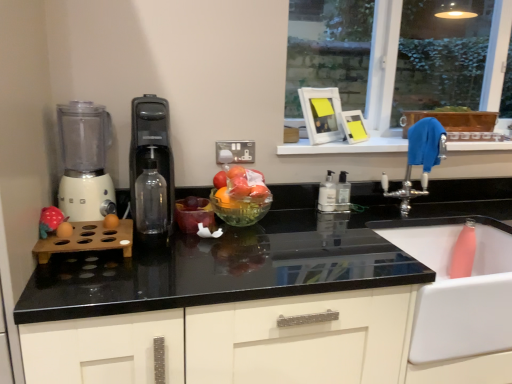
Describe the element at coordinates (345, 146) in the screenshot. I see `blue fabric at upper right` at that location.

Locate an element on the screen. Image resolution: width=512 pixels, height=384 pixels. clear plastic soap dispenser at center, the first bottle positioned from the right is located at coordinates (343, 193).

In order to face silver metallic faucet at upper right, should I rotate leftwards or rightwards?

To face it directly, rotate right by 20.633 degrees.

Find the location of `black plastic water dispenser at center`. black plastic water dispenser at center is located at coordinates 151,167.

Measure the distance between black plastic water dispenser at center and camera.

black plastic water dispenser at center and camera are 1.20 meters apart from each other.

Image resolution: width=512 pixels, height=384 pixels. Find the location of `blue fabric at upper right`. blue fabric at upper right is located at coordinates (345, 146).

Does point (42, 228) come farther from viewer compared to point (214, 189)?

No, it is in front of (214, 189).

Is matte pink plush toy at left oriented away from transparent glass bowl at center?

matte pink plush toy at left is not turned away from transparent glass bowl at center.

Which of these two, matte pink plush toy at left or transparent glass bowl at center, is smaller?

Smaller between the two is matte pink plush toy at left.

You are a GUI agent. You are given a task and a screenshot of the screen. Output one action in this format:
    pyautogui.click(x=<x>, y=<y>)
    Task: Click on the toy in front of the transparent glass bowl at center
    
    Given the screenshot: What is the action you would take?
    pyautogui.click(x=50, y=220)

Can you confirm if silver metallic faucet at upper right is positioned to the right of pink matte bottle at lower right?

No.

Where is `sink below the silver metallic faucet at upper right (from a real-world perspective)`? sink below the silver metallic faucet at upper right (from a real-world perspective) is located at coordinates (457, 287).

From the image's perspective, between silver metallic faucet at upper right and pink matte bottle at lower right, which one is located above?

silver metallic faucet at upper right is shown above in the image.

Is silver metallic faucet at upper right touching pink matte bottle at lower right?

No, silver metallic faucet at upper right is not touching pink matte bottle at lower right.

Between translucent plastic bowl at center and black glossy countertop at center, which one appears on the left side from the viewer's perspective?

translucent plastic bowl at center.

Is black glossy countertop at center surrounded by translucent plastic bowl at center?

No, translucent plastic bowl at center does not contain black glossy countertop at center.

Which point is more distant from viewer, (246, 196) or (89, 268)?

The point (246, 196) is behind.

From a real-world perspective, which is physically above, translucent plastic bowl at center or black glossy countertop at center?

From a 3D spatial view, translucent plastic bowl at center is above.

Looking at their sizes, would you say white plastic pump bottle at center, which is the second bottle from left to right, is wider or thinner than translucent plastic bowl at center?

Considering their sizes, white plastic pump bottle at center, which is the second bottle from left to right, looks slimmer than translucent plastic bowl at center.

Considering the sizes of white plastic pump bottle at center, the second bottle viewed from the front, and translucent plastic bowl at center in the image, is white plastic pump bottle at center, the second bottle viewed from the front, bigger or smaller than translucent plastic bowl at center?

In the image, white plastic pump bottle at center, the second bottle viewed from the front, appears to be smaller than translucent plastic bowl at center.

Is white plastic pump bottle at center, the second bottle viewed from the front, next to translucent plastic bowl at center?

No, white plastic pump bottle at center, the second bottle viewed from the front, is not in contact with translucent plastic bowl at center.

From the image's perspective, which bottle is the 2nd one below the translucent plastic bowl at center? Please provide its 2D coordinates.

[(327, 194)]

Is matte pink plush toy at left located outside transparent glass window at upper right?

Absolutely, matte pink plush toy at left is external to transparent glass window at upper right.

In terms of height, does matte pink plush toy at left look taller or shorter compared to transparent glass window at upper right?

Clearly, matte pink plush toy at left is shorter compared to transparent glass window at upper right.

Is matte pink plush toy at left wider than transparent glass window at upper right?

No, matte pink plush toy at left is not wider than transparent glass window at upper right.

Who is more distant, matte pink plush toy at left or transparent glass window at upper right?

transparent glass window at upper right is further from the camera.

In order to click on window sill located above the transparent glass bowl at center (from the image's perspective) in this screenshot , I will do `click(345, 146)`.

Does transparent glass bowl at center have a lesser height compared to blue fabric at upper right?

Incorrect, the height of transparent glass bowl at center does not fall short of that of blue fabric at upper right.

From the image's perspective, between transparent glass bowl at center and blue fabric at upper right, which one is located above?

From the image's view, blue fabric at upper right is above.

Between black plastic water dispenser at center and clear plastic soap dispenser at center, marked as the third bottle in a left-to-right arrangement, which one has smaller width?

Thinner between the two is clear plastic soap dispenser at center, marked as the third bottle in a left-to-right arrangement.

Is black plastic water dispenser at center facing towards clear plastic soap dispenser at center, marked as the third bottle in a left-to-right arrangement?

No, black plastic water dispenser at center is not turned towards clear plastic soap dispenser at center, marked as the third bottle in a left-to-right arrangement.

Who is shorter, black plastic water dispenser at center or clear plastic soap dispenser at center, marked as the third bottle in a left-to-right arrangement?

clear plastic soap dispenser at center, marked as the third bottle in a left-to-right arrangement.

What's the angular difference between black plastic water dispenser at center and clear plastic soap dispenser at center, placed as the third bottle when sorted from front to back,'s facing directions?

The angular difference between black plastic water dispenser at center and clear plastic soap dispenser at center, placed as the third bottle when sorted from front to back, is 0.632 degrees.

Where is `toy below the transparent glass bowl at center (from the image's perspective)`? toy below the transparent glass bowl at center (from the image's perspective) is located at coordinates (50, 220).

In the image, there is a silver metallic faucet at upper right. Where is `sink below it (from a real-world perspective)`? The height and width of the screenshot is (384, 512). sink below it (from a real-world perspective) is located at coordinates (457, 287).

Looking at the image, which one is located closer to transparent glass bowl at center, white matte blender at left or translucent plastic bowl at center?

Based on the image, translucent plastic bowl at center appears to be nearer to transparent glass bowl at center.

When comparing their distances from silver metallic faucet at upper right, does white matte blender at left or transparent glass bowl at center seem closer?

→ transparent glass bowl at center is positioned closer to the anchor silver metallic faucet at upper right.

When comparing their distances from transparent glass bottle at center, which appears as the first bottle when viewed from the front, does transparent glass window at upper right or clear plastic soap dispenser at center, arranged as the 1th bottle when viewed from the back, seem further?

Among the two, transparent glass window at upper right is located further to transparent glass bottle at center, which appears as the first bottle when viewed from the front.

Based on their spatial positions, is clear plastic soap dispenser at center, marked as the third bottle in a left-to-right arrangement, or white plastic pump bottle at center, the second bottle viewed from the front, closer to black plastic water dispenser at center?

Based on the image, white plastic pump bottle at center, the second bottle viewed from the front, appears to be nearer to black plastic water dispenser at center.

Which object lies further to the anchor point matte pink plush toy at left, transparent glass bowl at center or transparent glass bottle at center, positioned as the 3th bottle in back-to-front order?

transparent glass bowl at center.

From the image, which object appears to be nearer to transparent glass window at upper right, black plastic water dispenser at center or transparent glass bottle at center, marked as the 1th bottle in a left-to-right arrangement?

black plastic water dispenser at center is positioned closer to the anchor transparent glass window at upper right.

Considering their positions, is black glossy countertop at center positioned closer to translucent plastic bowl at center than pink matte bottle at lower right?

black glossy countertop at center is positioned closer to the anchor translucent plastic bowl at center.

When comparing their distances from white matte blender at left, does matte pink plush toy at left or pink matte bottle at lower right seem further?

pink matte bottle at lower right lies further to white matte blender at left than the other object.

Identify the location of kitchen appliance between white matte blender at left and pink matte bottle at lower right in the horizontal direction. (151, 167).

Where is `tap between black glossy countertop at center and clear plastic soap dispenser at center, the first bottle positioned from the right, from front to back`? tap between black glossy countertop at center and clear plastic soap dispenser at center, the first bottle positioned from the right, from front to back is located at coordinates (420, 159).

At what (x,y) coordinates should I click in order to perform the action: click on bottle located between matte pink plush toy at left and transparent glass bowl at center in the left-right direction. Please return your answer as a coordinate pair (x, y). Looking at the image, I should click on (151, 203).

Locate an element on the screen. glass bowl between black plastic water dispenser at center and transparent glass window at upper right is located at coordinates (241, 209).